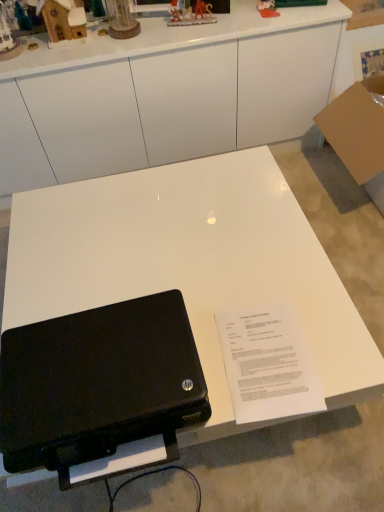
I want to click on vacant space in front of plastic toy at upper center, which ranks as the 1th toy in right-to-left order, so click(x=271, y=18).